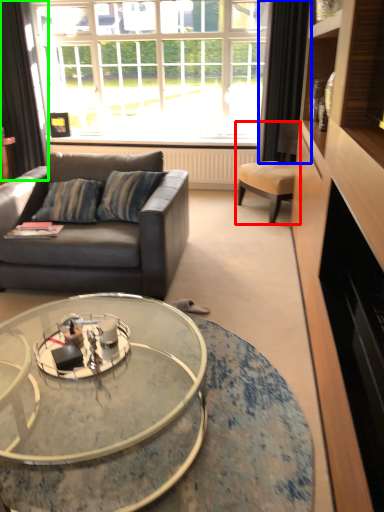
Question: Which object is positioned farthest from chair (highlighted by a red box)? Select from curtain (highlighted by a blue box) and curtain (highlighted by a green box).

Choices:
 (A) curtain
 (B) curtain

Answer: (B)